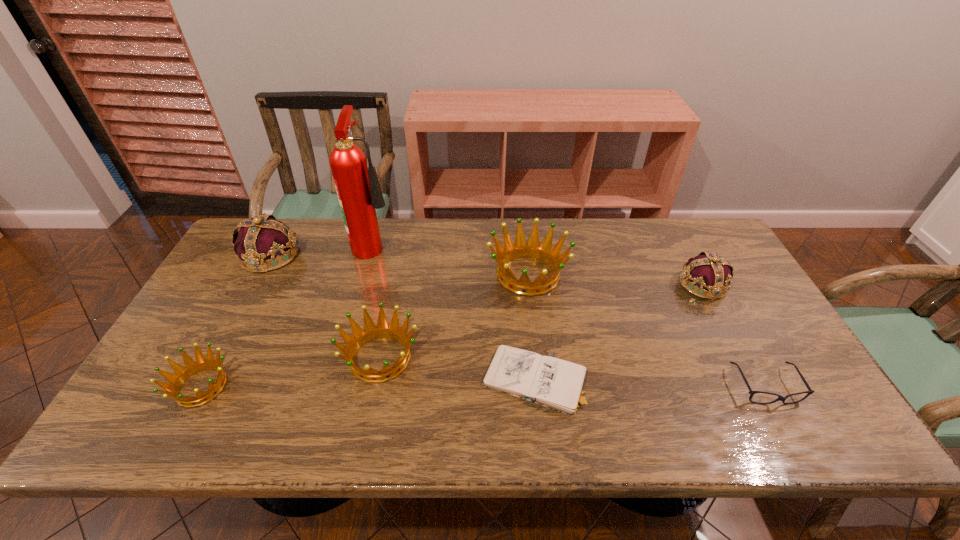
The image size is (960, 540). In order to click on the third shortest object in this screenshot , I will do `click(191, 367)`.

Locate an element on the screen. the leftmost golden crown is located at coordinates (191, 367).

Locate an element on the screen. The width and height of the screenshot is (960, 540). the seventh tallest object is located at coordinates (780, 398).

Identify the location of the shortest object. This screenshot has height=540, width=960. (551, 382).

At what (x,y) coordinates should I click in order to perform the action: click on free space located 0.100m at the nozzle of the red fire extinguisher. Please return your answer as a coordinate pair (x, y). Looking at the image, I should click on (426, 244).

Identify the location of free space located on the right of the bigger purple crown. (418, 255).

Find the location of a particular element. free space located 0.330m on the left of the biggest golden crown is located at coordinates (378, 274).

Find the location of `vacant space located 0.160m on the front of the smaller purple crown`. vacant space located 0.160m on the front of the smaller purple crown is located at coordinates tap(736, 348).

Where is `free space located 0.140m on the left of the second golden crown from left to right`? The height and width of the screenshot is (540, 960). free space located 0.140m on the left of the second golden crown from left to right is located at coordinates (285, 357).

Where is `vacant space located on the back of the leftmost golden crown`? vacant space located on the back of the leftmost golden crown is located at coordinates (249, 298).